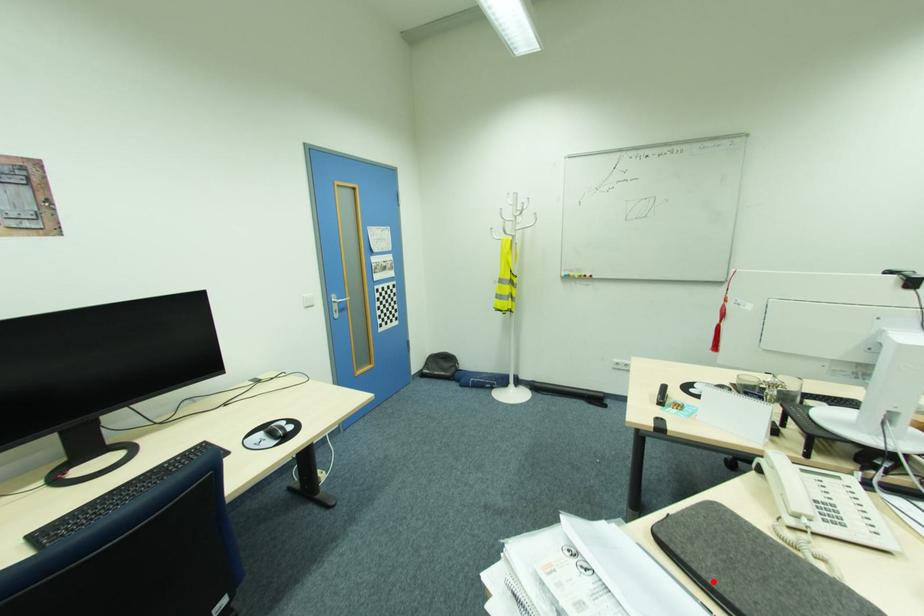
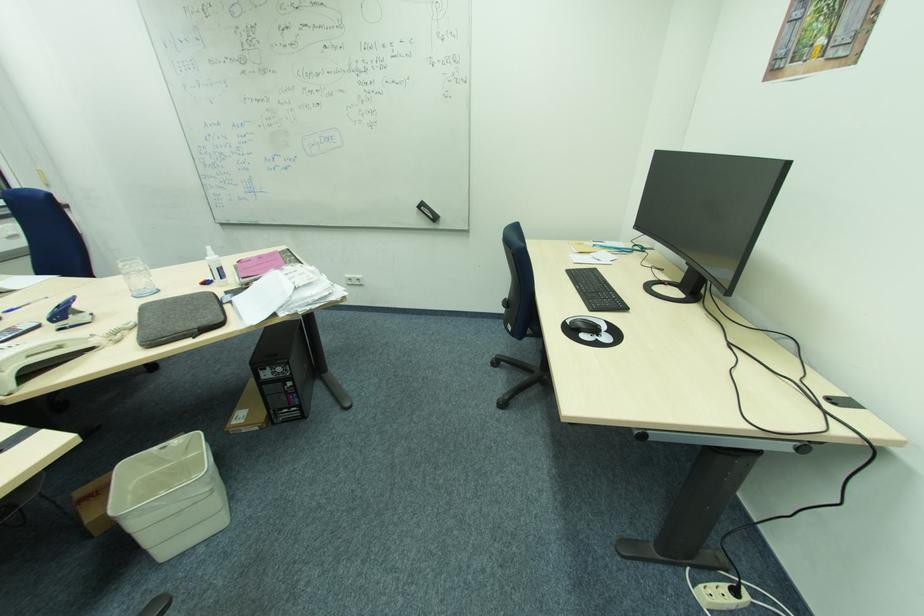
Where in the second image is the point corresponding to the highlighted location from the first image?

(222, 306)